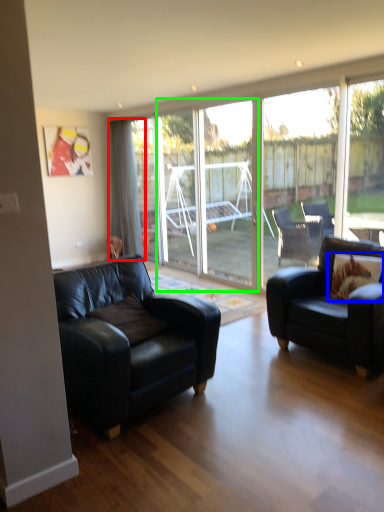
Question: Estimate the real-world distances between objects in this image. Which object is closer to curtain (highlighted by a red box), pillow (highlighted by a blue box) or screen door (highlighted by a green box)?

Choices:
 (A) pillow
 (B) screen door

Answer: (B)